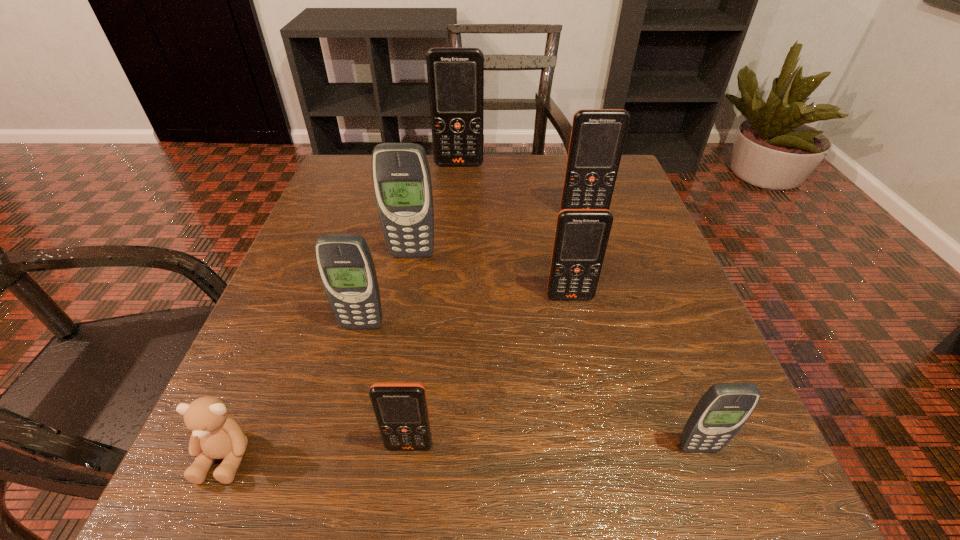
Identify the location of the tallest object. (455, 75).

You are a GUI agent. You are given a task and a screenshot of the screen. Output one action in this format:
    pyautogui.click(x=<x>, y=<y>)
    Task: Click on the farthest cellular telephone
    This screenshot has height=540, width=960.
    Given the screenshot: What is the action you would take?
    pyautogui.click(x=455, y=75)

Find the location of a particular element. This screenshot has width=960, height=540. the second farthest orange cellular telephone is located at coordinates (597, 139).

You are a GUI agent. You are given a task and a screenshot of the screen. Output one action in this format:
    pyautogui.click(x=<x>, y=<y>)
    Task: Click on the third smallest orange cellular telephone
    The image size is (960, 540).
    Given the screenshot: What is the action you would take?
    pyautogui.click(x=597, y=139)

Where is `the fifth nearest cellular telephone`? the fifth nearest cellular telephone is located at coordinates (401, 176).

The height and width of the screenshot is (540, 960). I want to click on the farthest gray cellular telephone, so click(x=401, y=176).

Locate an element on the screen. This screenshot has width=960, height=540. the second farthest gray cellular telephone is located at coordinates (345, 264).

You are a GUI agent. You are given a task and a screenshot of the screen. Output one action in this format:
    pyautogui.click(x=<x>, y=<y>)
    Task: Click on the fourth nearest object
    Image resolution: width=960 pixels, height=540 pixels.
    Given the screenshot: What is the action you would take?
    pyautogui.click(x=345, y=264)

At what (x,y) coordinates should I click in order to perform the action: click on the third farthest orange cellular telephone. Please return your answer as a coordinate pair (x, y). This screenshot has height=540, width=960. Looking at the image, I should click on (581, 236).

At what (x,y) coordinates should I click in order to perform the action: click on the fifth nearest object. Please return your answer as a coordinate pair (x, y). This screenshot has height=540, width=960. Looking at the image, I should click on (581, 236).